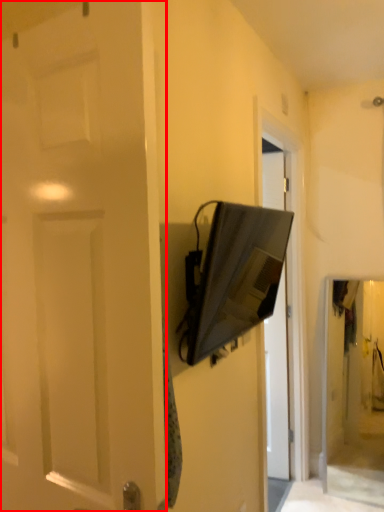
Question: Where is door (annotated by the red box) located in relation to medicine cabinet in the image?

Choices:
 (A) left
 (B) right

Answer: (A)